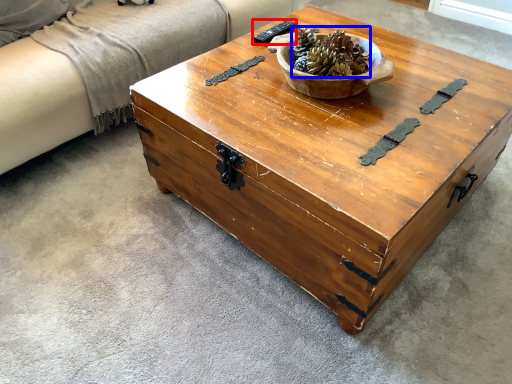
Question: Which object is further to the camera taking this photo, remote (highlighted by a red box) or centerpiece (highlighted by a blue box)?

Choices:
 (A) remote
 (B) centerpiece

Answer: (A)